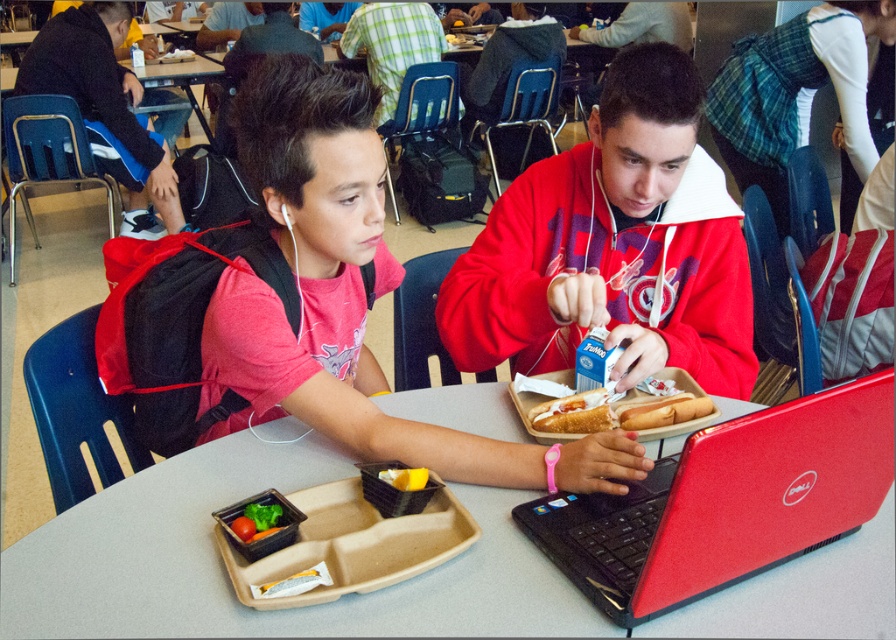
In the scene shown: You are standing in the school cafeteria and want to reach the point marked at coordinates point (365, 12). If you can walk at a speed of 1.2 meters per second, how many seconds will it take you to reach that point?

The distance between you and the point (365, 12) is 3.89 meters. At a speed of 1.2 meters per second, it will take approximately 3.24 seconds to reach the point.

You are a cafeteria worker who needs to place a new menu board between the red fleece hoodie at center and the green leafy vegetables at center. Since the menu board is 1.2 meters tall, will it fit vertically between them?

The red fleece hoodie at center is taller than the green leafy vegetables at center. The menu board is 1.2 meters tall. Since the hoodie is taller, the menu board can be placed between them vertically as long as the total height of both objects doesn